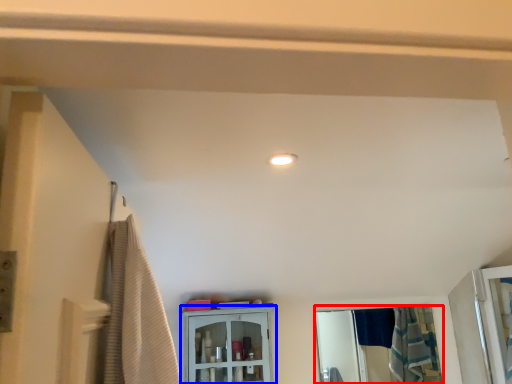
Question: Which object appears farthest to the camera in this image, mirror (highlighted by a red box) or cabinetry (highlighted by a blue box)?

Choices:
 (A) mirror
 (B) cabinetry

Answer: (A)